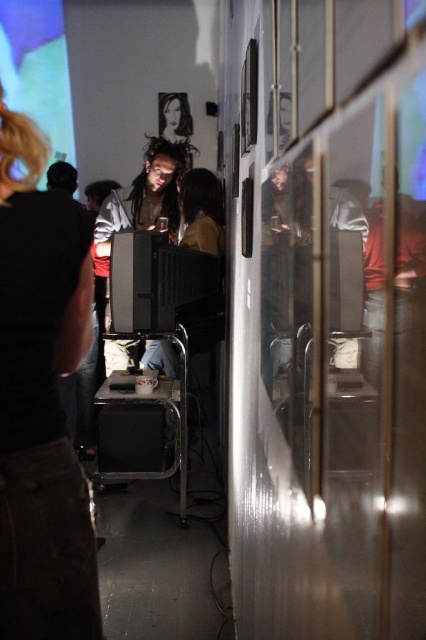
Between matte black screen at upper left and black plastic stool at center, which one appears on the right side from the viewer's perspective?

black plastic stool at center is more to the right.

Does matte black screen at upper left have a lesser height compared to black plastic stool at center?

No.

The image size is (426, 640). What do you see at coordinates (37, 68) in the screenshot? I see `matte black screen at upper left` at bounding box center [37, 68].

The width and height of the screenshot is (426, 640). Find the location of `matte black screen at upper left`. matte black screen at upper left is located at coordinates (37, 68).

Between black matte shirt at left and black plastic stool at center, which one has less height?

black plastic stool at center is shorter.

Describe the element at coordinates (42, 400) in the screenshot. The height and width of the screenshot is (640, 426). I see `black matte shirt at left` at that location.

Is point (63, 298) behind point (176, 396)?

No, (63, 298) is closer to viewer.

The width and height of the screenshot is (426, 640). I want to click on black matte shirt at left, so click(42, 400).

Looking at this image, can you confirm if black matte shirt at left is smaller than matte black screen at upper left?

Correct, black matte shirt at left occupies less space than matte black screen at upper left.

Is black matte shirt at left wider than matte black screen at upper left?

Incorrect, black matte shirt at left's width does not surpass matte black screen at upper left's.

Is point (45, 150) farther from camera compared to point (3, 6)?

No.

Find the location of a particular element. The image size is (426, 640). black matte shirt at left is located at coordinates (42, 400).